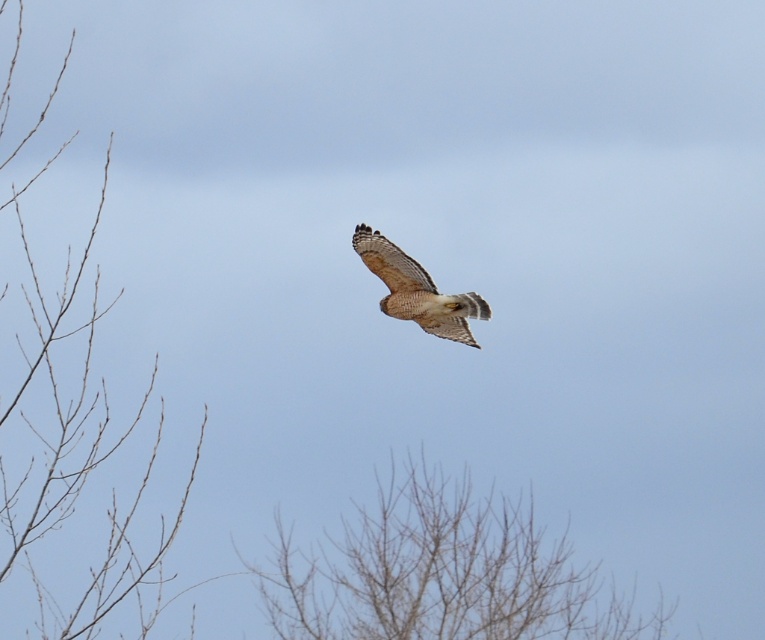
Question: Which object is positioned farthest from the bare branches at center?

Choices:
 (A) brown feathered eagle at center
 (B) bare branches at left

Answer: (B)

Question: Can you confirm if bare branches at center is positioned to the right of brown feathered eagle at center?

Choices:
 (A) yes
 (B) no

Answer: (A)

Question: Which point is farther to the camera?

Choices:
 (A) brown feathered eagle at center
 (B) bare branches at center
 (C) bare branches at left

Answer: (B)

Question: Can you confirm if bare branches at center is positioned to the right of brown feathered eagle at center?

Choices:
 (A) no
 (B) yes

Answer: (B)

Question: Is bare branches at left wider than brown feathered eagle at center?

Choices:
 (A) no
 (B) yes

Answer: (B)

Question: Which of the following is the closest to the observer?

Choices:
 (A) (360, 230)
 (B) (500, 570)

Answer: (A)